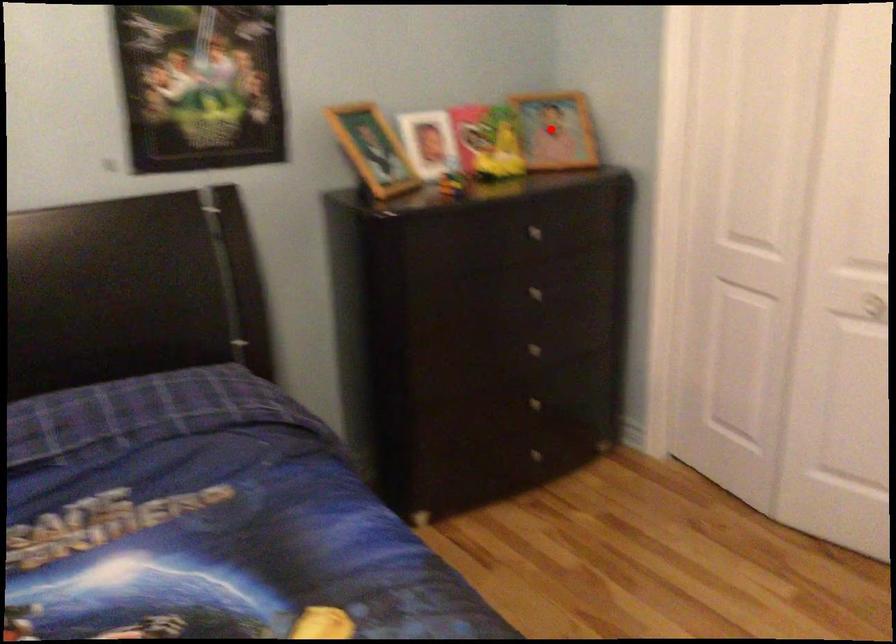
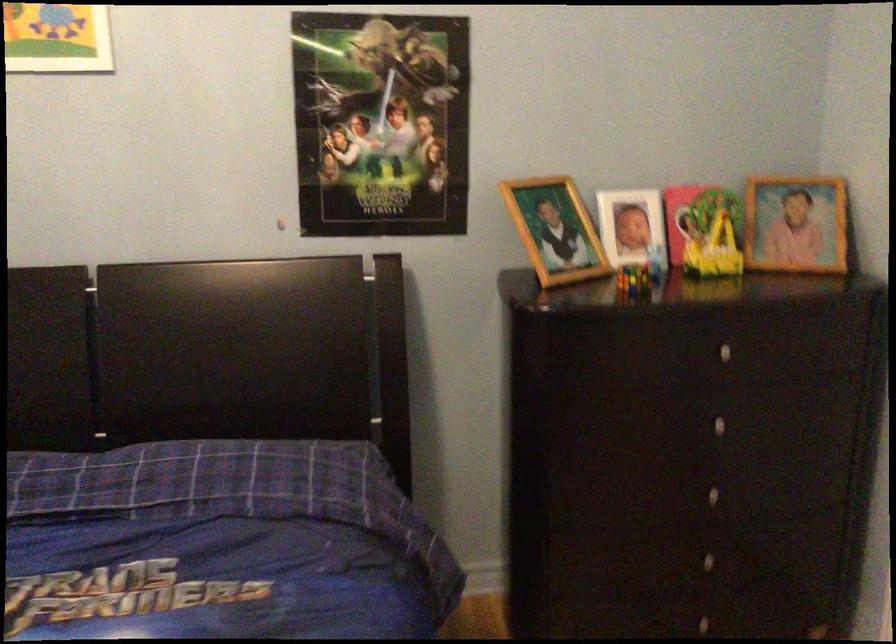
Find the pixel in the second image that matches the highlighted location in the first image.

(796, 223)